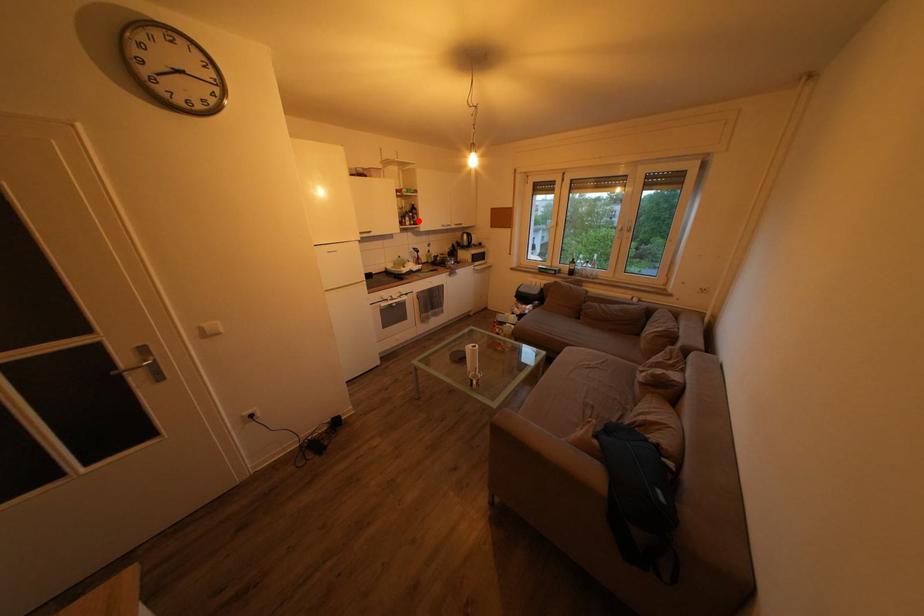
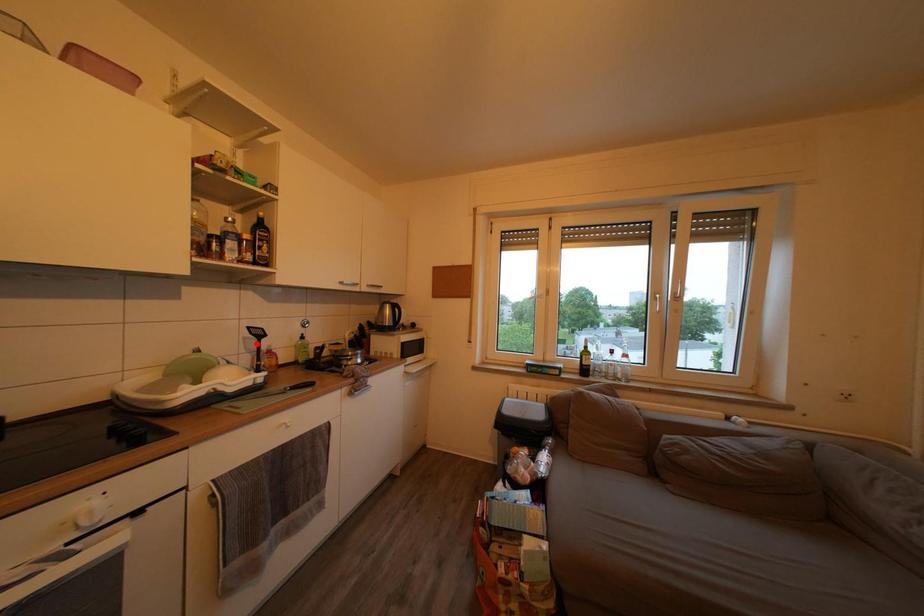
I am providing you with two images of the same scene from different viewpoints. A red point is marked on the first image and another point is marked on the second image. Is the red point in image1 aligned with the point shown in image2?

No